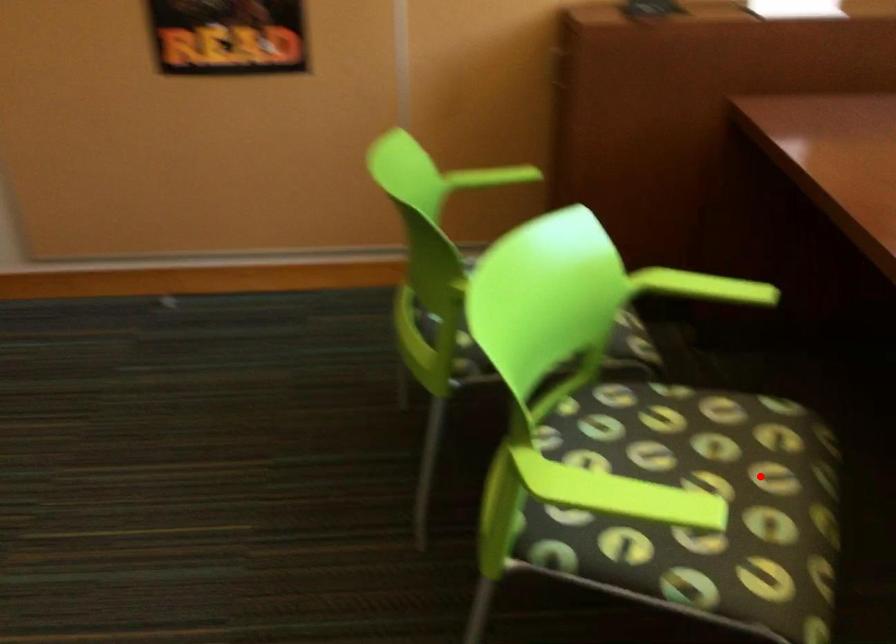
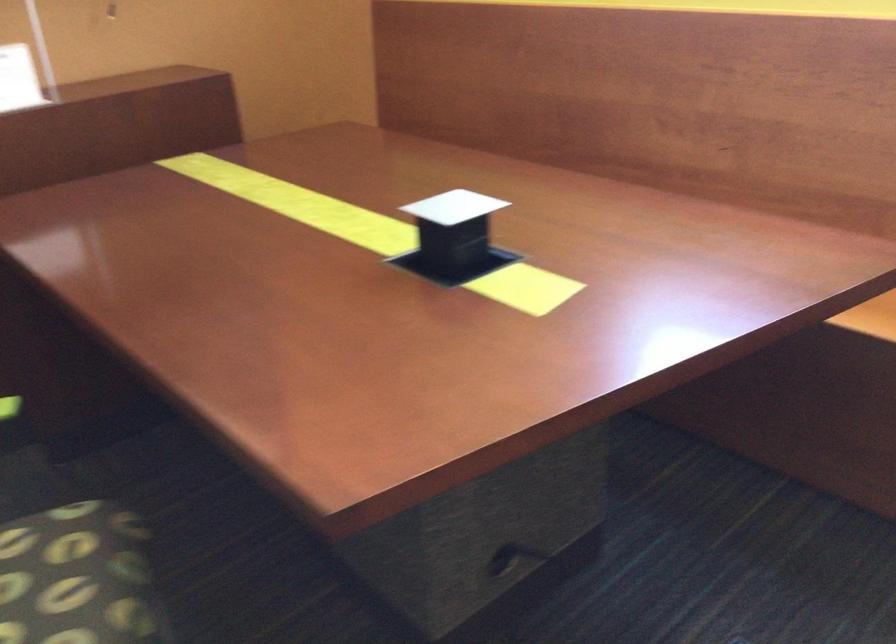
In the second image, find the point that corresponds to the highlighted location in the first image.

(74, 576)